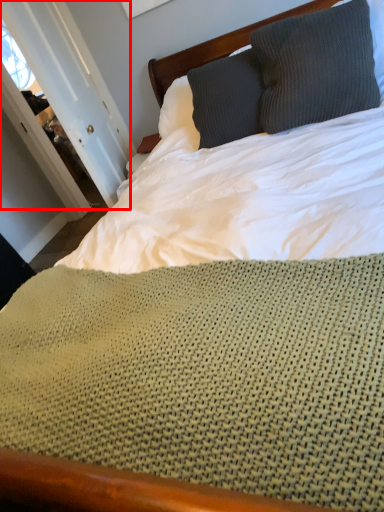
Question: Observing the image, what is the correct spatial positioning of door (annotated by the red box) in reference to pillow?

Choices:
 (A) left
 (B) right

Answer: (A)